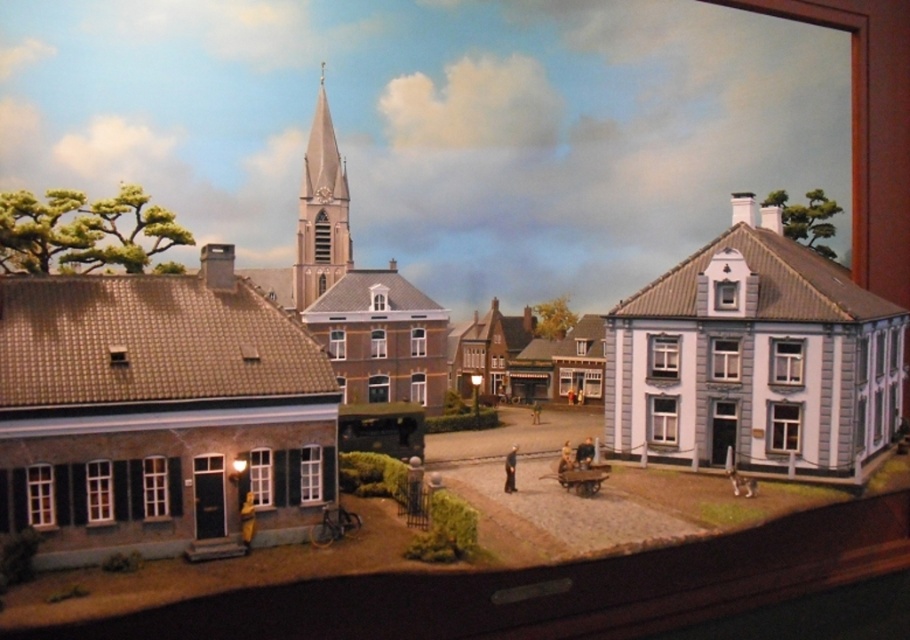
Between smooth beige steeple at center and wooden cart at center, which one appears on the left side from the viewer's perspective?

smooth beige steeple at center is more to the left.

Between smooth beige steeple at center and wooden cart at center, which one has more height?

smooth beige steeple at center is taller.

Between point (368, 298) and point (581, 492), which one is positioned behind?

Point (368, 298)

At what (x,y) coordinates should I click in order to perform the action: click on smooth beige steeple at center. Please return your answer as a coordinate pair (x, y). The height and width of the screenshot is (640, 910). Looking at the image, I should click on (355, 292).

Does white painted wood house at center right lie behind wooden cart at center?

Yes, white painted wood house at center right is behind wooden cart at center.

Between point (807, 259) and point (599, 468), which one is positioned in front?

Point (599, 468) is more forward.

You are a GUI agent. You are given a task and a screenshot of the screen. Output one action in this format:
    pyautogui.click(x=<x>, y=<y>)
    Task: Click on the white painted wood house at center right
    
    Given the screenshot: What is the action you would take?
    pyautogui.click(x=754, y=358)

Between white painted wood house at center right and smooth beige steeple at center, which one appears on the right side from the viewer's perspective?

white painted wood house at center right is more to the right.

Does point (684, 326) come in front of point (336, 316)?

Yes, point (684, 326) is closer to viewer.

Where is `white painted wood house at center right`? white painted wood house at center right is located at coordinates (754, 358).